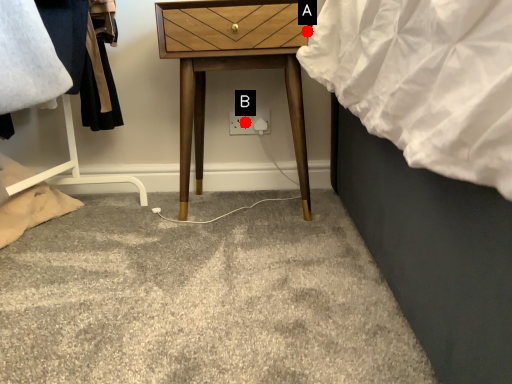
Question: Two points are circled on the image, labeled by A and B beside each circle. Which point is closer to the camera?

Choices:
 (A) A is closer
 (B) B is closer

Answer: (A)